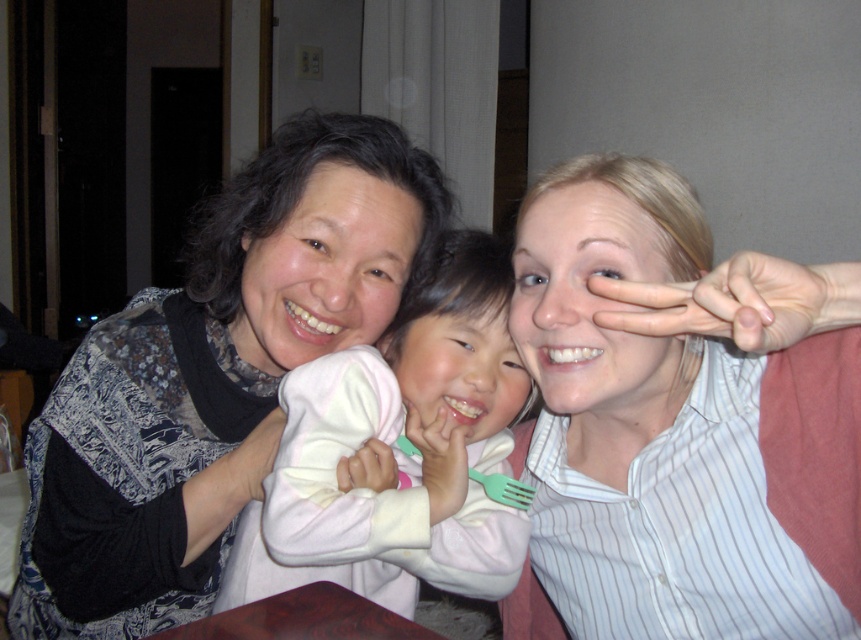
Which is below, soft pink fabric at center or green plastic fork at center?

green plastic fork at center is below.

Does soft pink fabric at center have a greater width compared to green plastic fork at center?

Yes, soft pink fabric at center is wider than green plastic fork at center.

Who is more forward, (323, 531) or (474, 474)?

Point (323, 531) is more forward.

In order to click on soft pink fabric at center in this screenshot , I will do [410, 442].

Is point (48, 518) farther from viewer compared to point (457, 486)?

Yes.

Does matte black sweater at left have a greater height compared to soft pink fabric at center?

Correct, matte black sweater at left is much taller as soft pink fabric at center.

Where is `matte black sweater at left`? This screenshot has height=640, width=861. matte black sweater at left is located at coordinates 212,378.

The width and height of the screenshot is (861, 640). What are the coordinates of `matte black sweater at left` in the screenshot? It's located at (212, 378).

In the scene shown: Is matte black sweater at left taller than green plastic fork at center?

Yes, matte black sweater at left is taller than green plastic fork at center.

Is matte black sweater at left wider than green plastic fork at center?

Indeed, matte black sweater at left has a greater width compared to green plastic fork at center.

Is point (78, 352) farther from viewer compared to point (506, 496)?

Yes, point (78, 352) is behind point (506, 496).

You are a GUI agent. You are given a task and a screenshot of the screen. Output one action in this format:
    pyautogui.click(x=<x>, y=<y>)
    Task: Click on the matte black sweater at left
    The height and width of the screenshot is (640, 861).
    Given the screenshot: What is the action you would take?
    pyautogui.click(x=212, y=378)